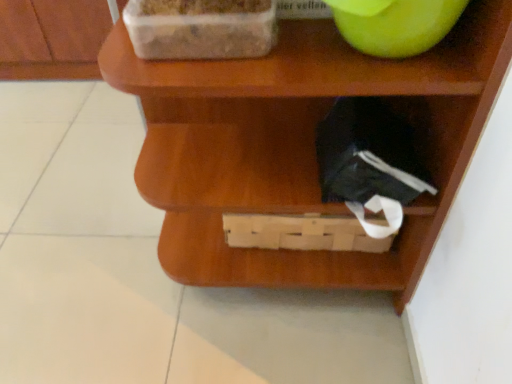
This screenshot has width=512, height=384. What are the coordinates of `wooden basket at lower center` in the screenshot? It's located at (300, 144).

This screenshot has width=512, height=384. Identify the location of green matte apple at upper right. (395, 24).

Find the location of `transparent plastic container at upper left`. transparent plastic container at upper left is located at coordinates (x=201, y=28).

From the image's perspective, is green matte apple at upper right above wooden basket at lower center?

Yes, from the image's perspective, green matte apple at upper right is on top of wooden basket at lower center.

Consider the image. From a real-world perspective, which object rests below the other?

wooden basket at lower center, from a real-world perspective.

Between green matte apple at upper right and wooden basket at lower center, which one is positioned behind?

green matte apple at upper right is behind.

Can you confirm if green matte apple at upper right is bigger than wooden basket at lower center?

No, green matte apple at upper right is not bigger than wooden basket at lower center.

Could you tell me if wooden basket at lower center is turned towards green matte apple at upper right?

No, wooden basket at lower center does not turn towards green matte apple at upper right.

From the image's perspective, between wooden basket at lower center and green matte apple at upper right, who is located below?

wooden basket at lower center is shown below in the image.

Considering the points (178, 145) and (435, 44), which point is behind, point (178, 145) or point (435, 44)?

Positioned behind is point (178, 145).

Which object is closer to the camera, wooden basket at lower center or green matte apple at upper right?

wooden basket at lower center is closer to the camera.

From the image's perspective, between green matte apple at upper right and transparent plastic container at upper left, who is located below?

transparent plastic container at upper left, from the image's perspective.

Find the location of a particular element. The height and width of the screenshot is (384, 512). apple located on the right of transparent plastic container at upper left is located at coordinates (395, 24).

Could transparent plastic container at upper left be considered to be inside green matte apple at upper right?

No.

Is green matte apple at upper right looking in the opposite direction of transparent plastic container at upper left?

No, green matte apple at upper right's orientation is not away from transparent plastic container at upper left.

Is transparent plastic container at upper left next to wooden basket at lower center?

No, transparent plastic container at upper left is not with wooden basket at lower center.

Where is `shelf to the right of transparent plastic container at upper left`? The width and height of the screenshot is (512, 384). shelf to the right of transparent plastic container at upper left is located at coordinates pyautogui.click(x=300, y=144).

How far apart are transparent plastic container at upper left and wooden basket at lower center?

The distance of transparent plastic container at upper left from wooden basket at lower center is 9.58 inches.

From the image's perspective, is transparent plastic container at upper left above wooden basket at lower center?

Correct, transparent plastic container at upper left appears higher than wooden basket at lower center in the image.

In the scene shown: In the image, is wooden basket at lower center positioned in front of or behind transparent plastic container at upper left?

wooden basket at lower center is in front of transparent plastic container at upper left.

Where is `wide on the left of wooden basket at lower center`? Image resolution: width=512 pixels, height=384 pixels. wide on the left of wooden basket at lower center is located at coordinates (201, 28).

Is wooden basket at lower center bigger than transparent plastic container at upper left?

Indeed, wooden basket at lower center has a larger size compared to transparent plastic container at upper left.

From the image's perspective, is transparent plastic container at upper left positioned above or below green matte apple at upper right?

transparent plastic container at upper left is below green matte apple at upper right.

From a real-world perspective, which object stands above the other?

green matte apple at upper right, from a real-world perspective.

Which of these two, transparent plastic container at upper left or green matte apple at upper right, is bigger?

green matte apple at upper right.

Could green matte apple at upper right be considered to be inside transparent plastic container at upper left?

Definitely not — green matte apple at upper right is not inside transparent plastic container at upper left.

Locate an element on the screen. shelf below the green matte apple at upper right (from the image's perspective) is located at coordinates (300, 144).

Locate an element on the screen. The image size is (512, 384). apple above the wooden basket at lower center (from the image's perspective) is located at coordinates tap(395, 24).

Looking at the image, which one is located further to transparent plastic container at upper left, green matte apple at upper right or wooden basket at lower center?

wooden basket at lower center is further to transparent plastic container at upper left.

Estimate the real-world distances between objects in this image. Which object is closer to green matte apple at upper right, wooden basket at lower center or transparent plastic container at upper left?

transparent plastic container at upper left.

Considering their positions, is transparent plastic container at upper left positioned further to wooden basket at lower center than green matte apple at upper right?

green matte apple at upper right.

Based on their spatial positions, is green matte apple at upper right or transparent plastic container at upper left closer to wooden basket at lower center?

transparent plastic container at upper left.

Which object lies nearer to the anchor point green matte apple at upper right, transparent plastic container at upper left or wooden basket at lower center?

transparent plastic container at upper left.

When comparing their distances from transparent plastic container at upper left, does wooden basket at lower center or green matte apple at upper right seem further?

Among the two, wooden basket at lower center is located further to transparent plastic container at upper left.

You are a GUI agent. You are given a task and a screenshot of the screen. Output one action in this format:
    pyautogui.click(x=<x>, y=<y>)
    Task: Click on the shelf between transparent plastic container at upper left and green matte apple at upper right
    
    Given the screenshot: What is the action you would take?
    pyautogui.click(x=300, y=144)